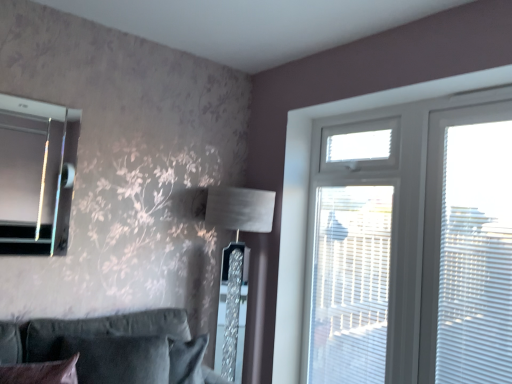
Measure the distance between matte glass bay window at upper left and camera.

The distance of matte glass bay window at upper left from camera is 6.25 feet.

Image resolution: width=512 pixels, height=384 pixels. What are the coordinates of `white plastic blinds at right` in the screenshot? It's located at (468, 247).

This screenshot has width=512, height=384. In order to click on suede-like dark green couch at lower left in this screenshot , I will do `click(103, 336)`.

Where is `velvet dark brown pillow at lower left`? The image size is (512, 384). velvet dark brown pillow at lower left is located at coordinates (41, 372).

Is satin silver lampshade at center turned away from suede-like dark green couch at lower left?

satin silver lampshade at center is not turned away from suede-like dark green couch at lower left.

Is satin silver lampshade at center outside of suede-like dark green couch at lower left?

That's correct, satin silver lampshade at center is outside of suede-like dark green couch at lower left.

Is satin silver lampshade at center placed right next to suede-like dark green couch at lower left?

satin silver lampshade at center is not next to suede-like dark green couch at lower left, and they're not touching.

Which object is thinner, satin silver lampshade at center or suede-like dark green couch at lower left?

Thinner between the two is suede-like dark green couch at lower left.

Is white plastic blinds at right beside white plastic window at upper right?

There is a gap between white plastic blinds at right and white plastic window at upper right.

Considering the positions of objects white plastic blinds at right and white plastic window at upper right in the image provided, who is in front, white plastic blinds at right or white plastic window at upper right?

white plastic window at upper right.

Image resolution: width=512 pixels, height=384 pixels. I want to click on window lying on the left of white plastic blinds at right, so click(x=307, y=198).

Measure the distance between white plastic blinds at right and white plastic window at upper right.

white plastic blinds at right and white plastic window at upper right are 25.96 inches apart from each other.

Is velvet dark brown pillow at lower left bigger or smaller than matte glass bay window at upper left?

velvet dark brown pillow at lower left is bigger than matte glass bay window at upper left.

From the picture: Does velvet dark brown pillow at lower left contain matte glass bay window at upper left?

No, velvet dark brown pillow at lower left does not contain matte glass bay window at upper left.

From a real-world perspective, relative to velvet dark brown pillow at lower left, is white plastic screen door at upper right vertically above or below?

white plastic screen door at upper right is situated higher than velvet dark brown pillow at lower left in the real world.

Is white plastic screen door at upper right taller or shorter than velvet dark brown pillow at lower left?

white plastic screen door at upper right is taller than velvet dark brown pillow at lower left.

Considering the relative sizes of white plastic screen door at upper right and velvet dark brown pillow at lower left in the image provided, is white plastic screen door at upper right thinner than velvet dark brown pillow at lower left?

Indeed, white plastic screen door at upper right has a lesser width compared to velvet dark brown pillow at lower left.

Can you confirm if white plastic screen door at upper right is positioned to the right of velvet dark brown pillow at lower left?

Correct, you'll find white plastic screen door at upper right to the right of velvet dark brown pillow at lower left.

I want to click on screen door beneath the white plastic blinds at right (from a real-world perspective), so click(x=350, y=284).

Is point (356, 323) in front of point (426, 272)?

No.

Is white plastic screen door at upper right positioned before white plastic blinds at right?

No.

Would you say white plastic screen door at upper right contains white plastic blinds at right?

No.

Considering the relative sizes of white plastic screen door at upper right and satin silver lampshade at center in the image provided, is white plastic screen door at upper right shorter than satin silver lampshade at center?

Indeed, white plastic screen door at upper right has a lesser height compared to satin silver lampshade at center.

Considering the positions of objects white plastic screen door at upper right and satin silver lampshade at center in the image provided, who is more to the left, white plastic screen door at upper right or satin silver lampshade at center?

From the viewer's perspective, satin silver lampshade at center appears more on the left side.

Is white plastic screen door at upper right facing away from satin silver lampshade at center?

No, white plastic screen door at upper right's orientation is not away from satin silver lampshade at center.

From a real-world perspective, is white plastic screen door at upper right positioned under satin silver lampshade at center based on gravity?

Actually, white plastic screen door at upper right is physically above satin silver lampshade at center in the real world.

How distant is white plastic blinds at right from satin silver lampshade at center?

white plastic blinds at right and satin silver lampshade at center are 1.04 meters apart from each other.

Which is behind, point (464, 141) or point (231, 190)?

The point (231, 190) is more distant.

Can you tell me how much white plastic blinds at right and satin silver lampshade at center differ in facing direction?

The angle between the facing direction of white plastic blinds at right and the facing direction of satin silver lampshade at center is 89.2 degrees.

In order to click on window blind in front of the satin silver lampshade at center in this screenshot , I will do `click(468, 247)`.

In order to click on table lamp behind the suede-like dark green couch at lower left in this screenshot , I will do `click(240, 209)`.

You are a GUI agent. You are given a task and a screenshot of the screen. Output one action in this format:
    pyautogui.click(x=<x>, y=<y>)
    Task: Click on the window below the white plastic blinds at right (from the image's perspective)
    
    Given the screenshot: What is the action you would take?
    pyautogui.click(x=307, y=198)

Considering their positions, is white plastic blinds at right positioned further to white plastic window at upper right than velvet dark brown pillow at lower left?

velvet dark brown pillow at lower left lies further to white plastic window at upper right than the other object.

Estimate the real-world distances between objects in this image. Which object is further from velvet dark brown pillow at lower left, satin silver lampshade at center or white plastic blinds at right?

Based on the image, white plastic blinds at right appears to be further to velvet dark brown pillow at lower left.

When comparing their distances from suede-like dark green couch at lower left, does white plastic screen door at upper right or matte glass bay window at upper left seem further?

white plastic screen door at upper right.

Consider the image. When comparing their distances from white plastic window at upper right, does satin silver lampshade at center or white plastic blinds at right seem closer?

Among the two, satin silver lampshade at center is located nearer to white plastic window at upper right.

In the scene shown: Estimate the real-world distances between objects in this image. Which object is closer to velvet dark brown pillow at lower left, matte glass bay window at upper left or suede-like dark green couch at lower left?

Based on the image, suede-like dark green couch at lower left appears to be nearer to velvet dark brown pillow at lower left.

When comparing their distances from matte glass bay window at upper left, does satin silver lampshade at center or velvet dark brown pillow at lower left seem closer?

Based on the image, velvet dark brown pillow at lower left appears to be nearer to matte glass bay window at upper left.

From the image, which object appears to be farther from velvet dark brown pillow at lower left, matte glass bay window at upper left or white plastic blinds at right?

white plastic blinds at right is further to velvet dark brown pillow at lower left.

Looking at the image, which one is located closer to white plastic window at upper right, matte glass bay window at upper left or velvet dark brown pillow at lower left?

Based on the image, matte glass bay window at upper left appears to be nearer to white plastic window at upper right.

Locate an element on the screen. screen door between matte glass bay window at upper left and white plastic window at upper right from left to right is located at coordinates (350, 284).

The width and height of the screenshot is (512, 384). What are the coordinates of `screen door located between suede-like dark green couch at lower left and white plastic blinds at right in the left-right direction` in the screenshot? It's located at (350, 284).

Identify the location of table lamp located between suede-like dark green couch at lower left and white plastic blinds at right in the left-right direction. (240, 209).

Find the location of a particular element. The width and height of the screenshot is (512, 384). pillow between matte glass bay window at upper left and white plastic screen door at upper right from left to right is located at coordinates (41, 372).